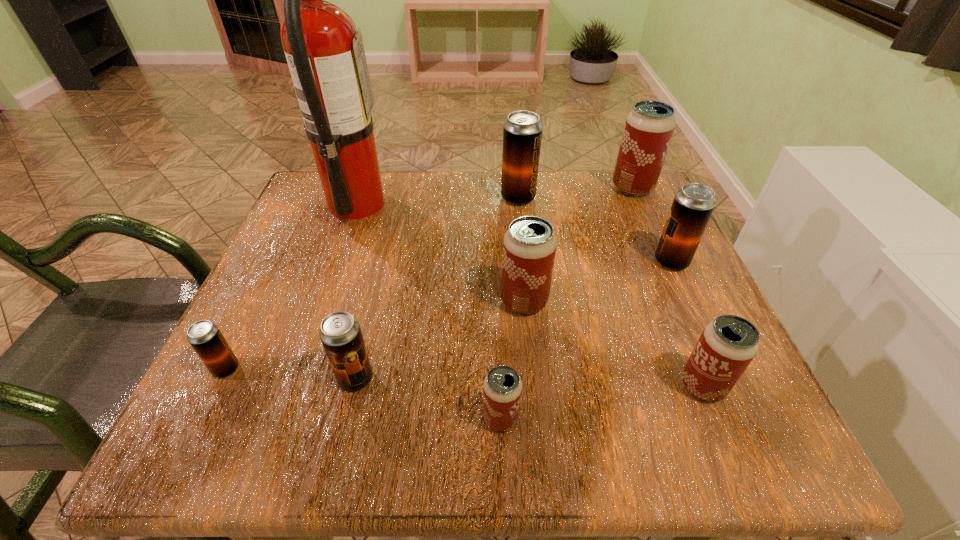
Locate an element on the screen. Image resolution: width=960 pixels, height=540 pixels. fire extinguisher is located at coordinates point(326,58).

Find the location of a particular element. This screenshot has height=540, width=960. red fire extinguisher is located at coordinates (326, 58).

Where is `the third black beer can from left to right`? The image size is (960, 540). the third black beer can from left to right is located at coordinates (522, 132).

Where is `the biggest black beer can`? the biggest black beer can is located at coordinates (522, 132).

Locate an element on the screen. Image resolution: width=960 pixels, height=540 pixels. the biggest red beer can is located at coordinates (649, 127).

The image size is (960, 540). I want to click on the second farthest black beer can, so click(x=693, y=205).

Where is `the sixth nearest beer can`? The image size is (960, 540). the sixth nearest beer can is located at coordinates (693, 205).

Find the location of a particular element. This screenshot has width=960, height=540. the second biggest red beer can is located at coordinates (529, 248).

Find the location of a particular element. This screenshot has height=540, width=960. the fourth farthest beer can is located at coordinates (529, 248).

You are a GUI agent. You are given a task and a screenshot of the screen. Output one action in this format:
    pyautogui.click(x=<x>, y=<y>)
    Task: Click on the second black beer can from left to right
    
    Given the screenshot: What is the action you would take?
    pyautogui.click(x=340, y=333)